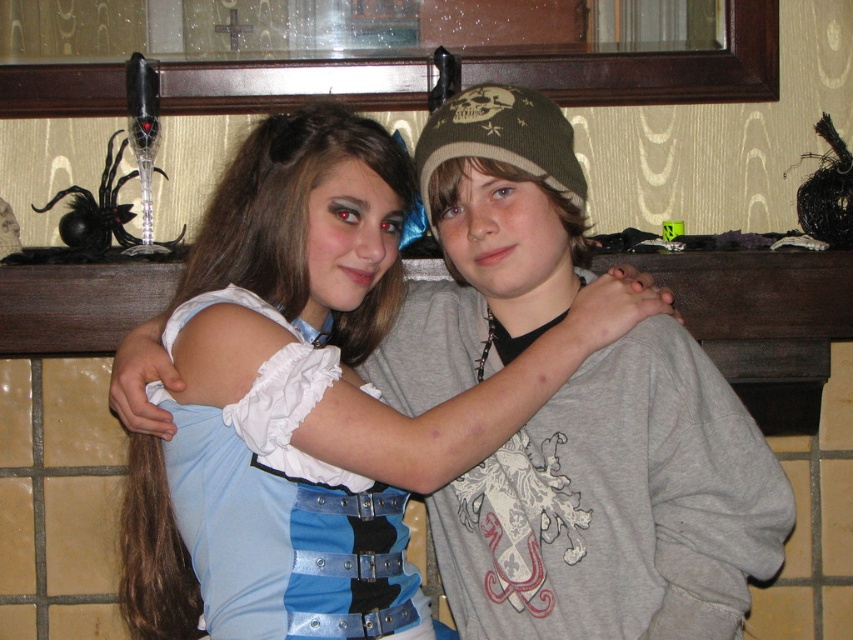
You are standing in front of the wooden shelf and want to place a small decoration exactly at the position marked by point (x=618, y=506). What object is currently at that location?

The point (x=618, y=506) marks the location of the gray cotton sweatshirt at center.

You are standing in the room where the two people are posing. You notice two points marked on the wall. The first point is at coordinate point (471, 264) and the second point is at coordinate point (386, 220). Which point is closer to you?

Point (471, 264) is closer to you because it is further to the viewer than point (386, 220).